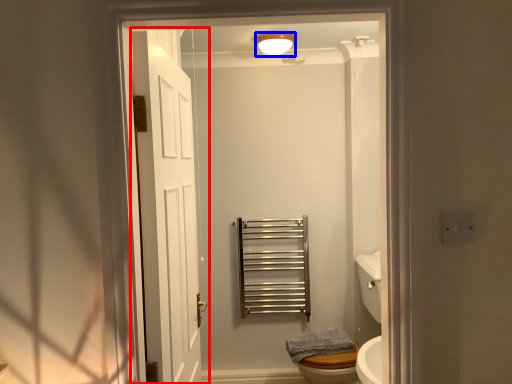
Question: Which point is further to the camera, door (highlighted by a red box) or light fixture (highlighted by a blue box)?

Choices:
 (A) door
 (B) light fixture

Answer: (B)